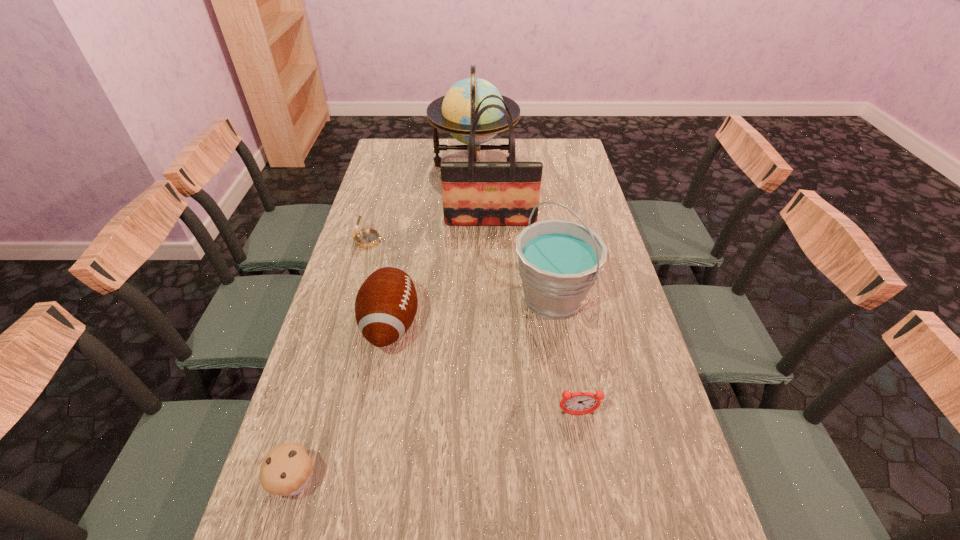
What are the coordinates of `free space located 0.330m on the laces of the fourth shortest object` in the screenshot? It's located at (539, 324).

Where is `vacant space situated with the dial facing the compass`? This screenshot has height=540, width=960. vacant space situated with the dial facing the compass is located at coordinates (426, 241).

Locate an element on the screen. free space located on the front-facing side of the sixth farthest object is located at coordinates (585, 457).

In order to click on blank space located 0.190m on the right of the nearest object in this screenshot , I will do `click(410, 481)`.

At what (x,y) coordinates should I click in order to perform the action: click on object present at the far edge. Please return your answer as a coordinate pair (x, y). This screenshot has width=960, height=540. Looking at the image, I should click on (453, 113).

I want to click on football positioned at the left edge, so click(x=386, y=304).

Where is `compass at the left edge`? compass at the left edge is located at coordinates (367, 238).

What are the coordinates of `muffin that is positioned at the left edge` in the screenshot? It's located at (286, 469).

The image size is (960, 540). In order to click on bucket present at the right edge in this screenshot , I will do `click(559, 261)`.

Where is `alarm clock that is at the right edge`? alarm clock that is at the right edge is located at coordinates (579, 403).